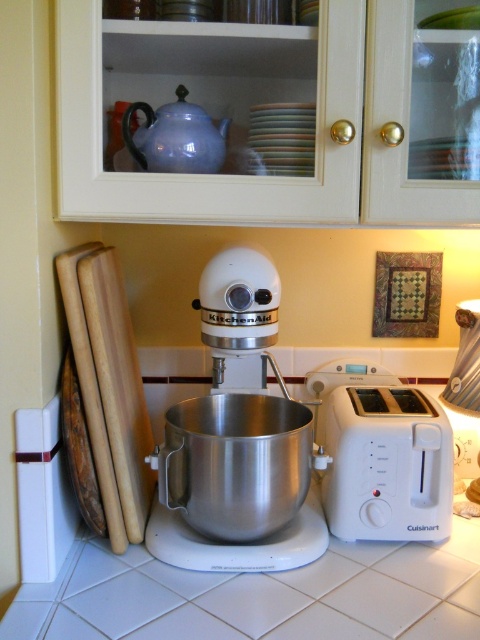
You are a chef who needs to reach both the white matte kitchenaid mixer at center and the matte blue teapot at upper center. Which object will you need to move first to access the other?

The white matte kitchenaid mixer at center is closer to you than the matte blue teapot at upper center. Therefore, you must move the white matte kitchenaid mixer at center first to access the matte blue teapot at upper center.

You are organizing the kitchen and need to place the white plastic toaster at right and the matte blue teapot at upper center into a cabinet that has a height limit of 12 inches. Given their heights, which one might not fit if the cabinet is exactly 12 inches tall?

The white plastic toaster at right is taller than the matte blue teapot at upper center. If the cabinet is exactly 12 inches tall, the white plastic toaster at right might not fit because it exceeds the height limit.

You are organizing the kitchen and need to place a new spice jar between the white matte KitchenAid mixer at center and the white plastic toaster at right. Based on their positions, which appliance should the spice jar be closer to?

The spice jar should be placed closer to the white plastic toaster at right since the white matte KitchenAid mixer at center is to the left of it.